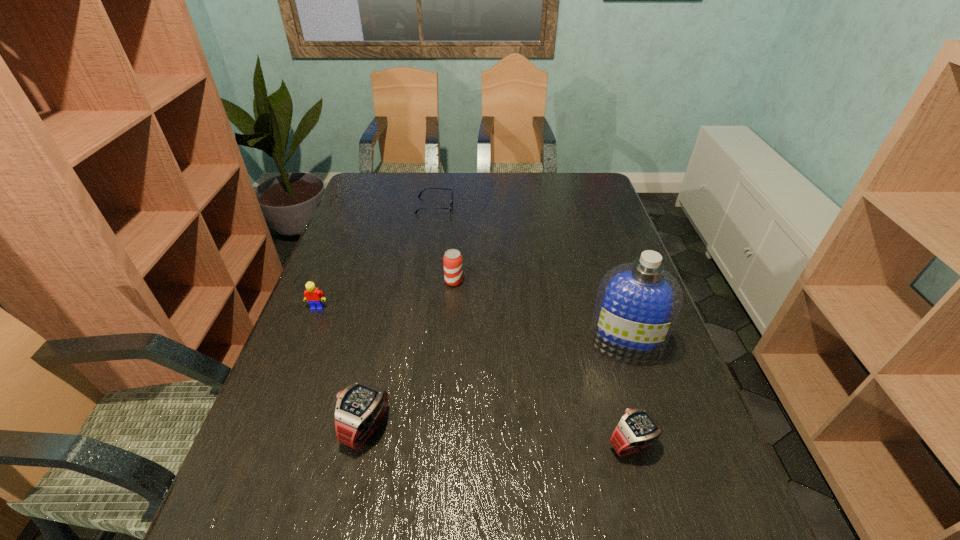
Locate an element on the screen. The width and height of the screenshot is (960, 540). free space that satisfies the following two spatial constraints: 1. on the front-facing side of the farthest object; 2. on the back side of the cleansing agent is located at coordinates (415, 343).

Where is `free spot that satisfies the following two spatial constraints: 1. on the back side of the shorter watch; 2. on the right side of the fourth farthest object`? This screenshot has height=540, width=960. free spot that satisfies the following two spatial constraints: 1. on the back side of the shorter watch; 2. on the right side of the fourth farthest object is located at coordinates (604, 343).

Locate an element on the screen. The width and height of the screenshot is (960, 540). vacant area that satisfies the following two spatial constraints: 1. on the back side of the fourth farthest object; 2. on the front-facing side of the shortest object is located at coordinates (580, 205).

This screenshot has height=540, width=960. Find the location of `free point that satisfies the following two spatial constraints: 1. on the front-facing side of the beer can; 2. on the right side of the farthest object`. free point that satisfies the following two spatial constraints: 1. on the front-facing side of the beer can; 2. on the right side of the farthest object is located at coordinates (423, 281).

Identify the location of vacant space that satisfies the following two spatial constraints: 1. on the back side of the third nearest object; 2. on the right side of the left watch. This screenshot has height=540, width=960. (384, 343).

The width and height of the screenshot is (960, 540). Find the location of `free spot that satisfies the following two spatial constraints: 1. on the front-facing side of the left watch; 2. on the left side of the Lego`. free spot that satisfies the following two spatial constraints: 1. on the front-facing side of the left watch; 2. on the left side of the Lego is located at coordinates (271, 428).